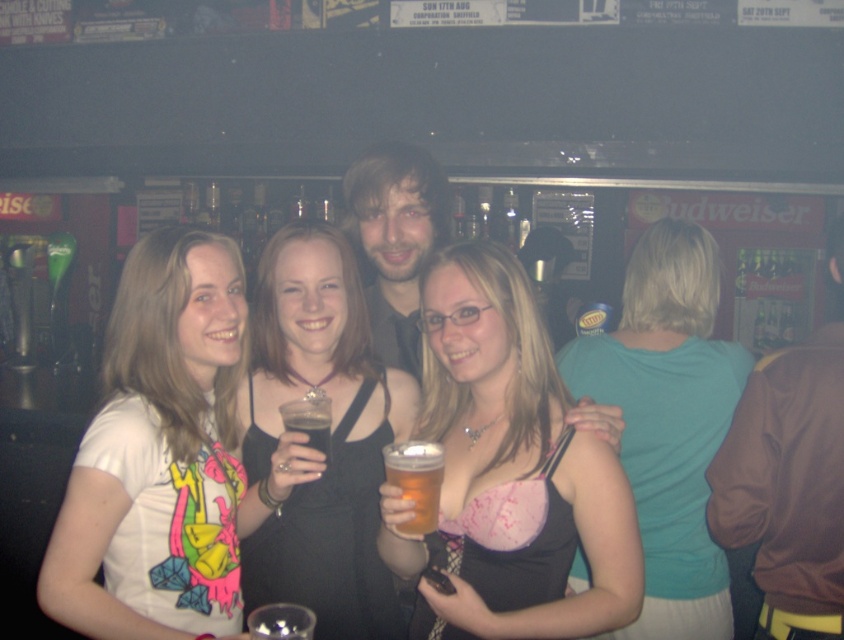
Between teal fabric shirt at upper right and brown leather jacket at right, which one appears on the right side from the viewer's perspective?

brown leather jacket at right

Does teal fabric shirt at upper right appear on the right side of brown leather jacket at right?

No, teal fabric shirt at upper right is not to the right of brown leather jacket at right.

Is point (583, 392) more distant than point (774, 394)?

Yes, point (583, 392) is farther from viewer.

In order to click on teal fabric shirt at upper right in this screenshot , I will do `click(668, 420)`.

Is pink satin dress at center thinner than translucent glass beer at center?

No, pink satin dress at center is not thinner than translucent glass beer at center.

This screenshot has height=640, width=844. Find the location of `pink satin dress at center`. pink satin dress at center is located at coordinates (509, 470).

Can you confirm if white matte t-shirt at left is wider than translucent glass beer at center?

Yes.

Which of these two, white matte t-shirt at left or translucent glass beer at center, stands shorter?

With less height is translucent glass beer at center.

Which is behind, point (95, 605) or point (327, 460)?

Positioned behind is point (327, 460).

At what (x,y) coordinates should I click in order to perform the action: click on white matte t-shirt at left. Please return your answer as a coordinate pair (x, y). Image resolution: width=844 pixels, height=640 pixels. Looking at the image, I should click on (161, 456).